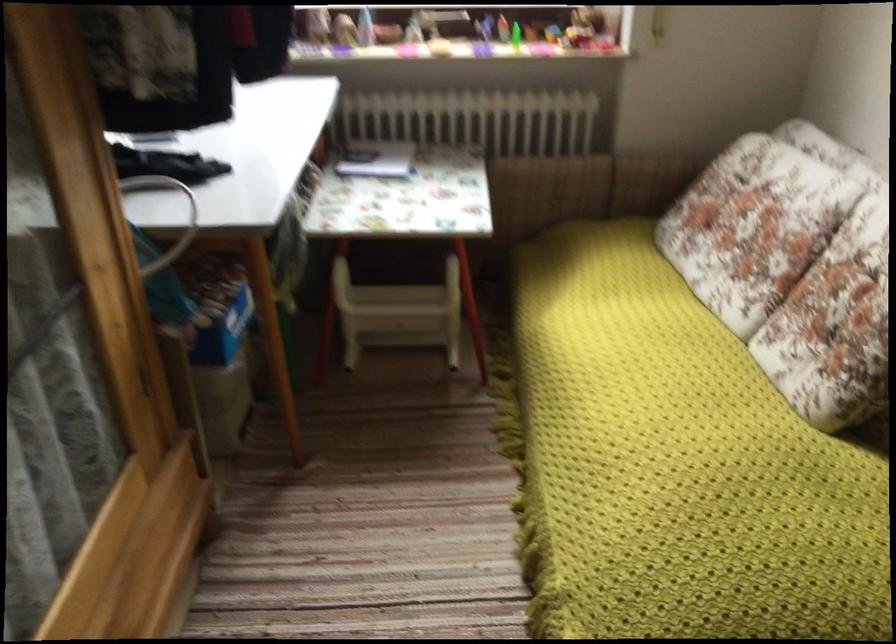
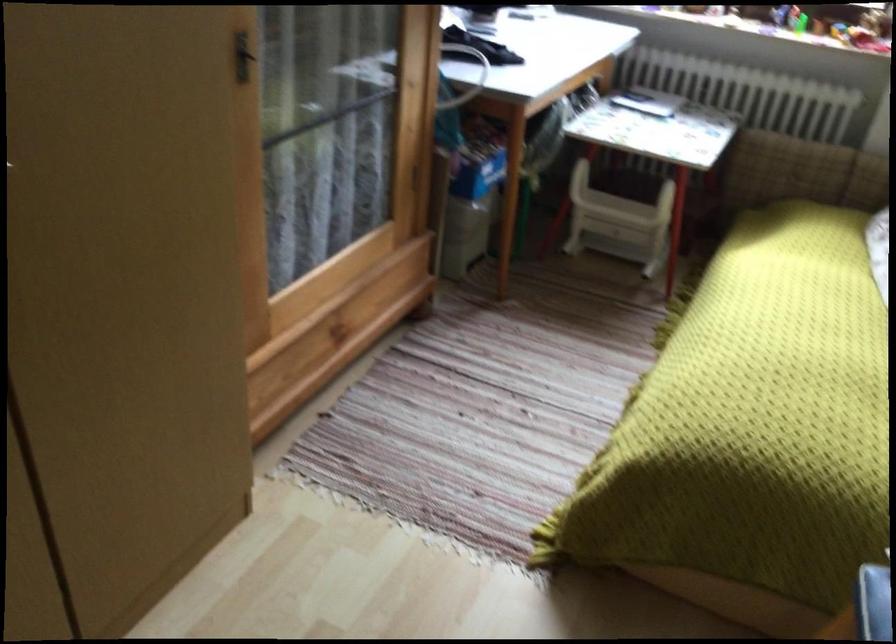
Question: The camera is either moving clockwise (left) or counter-clockwise (right) around the object. The first image is from the beginning of the video and the second image is from the end. Is the camera moving left or right when shooting the video?

Choices:
 (A) Left
 (B) Right

Answer: (B)